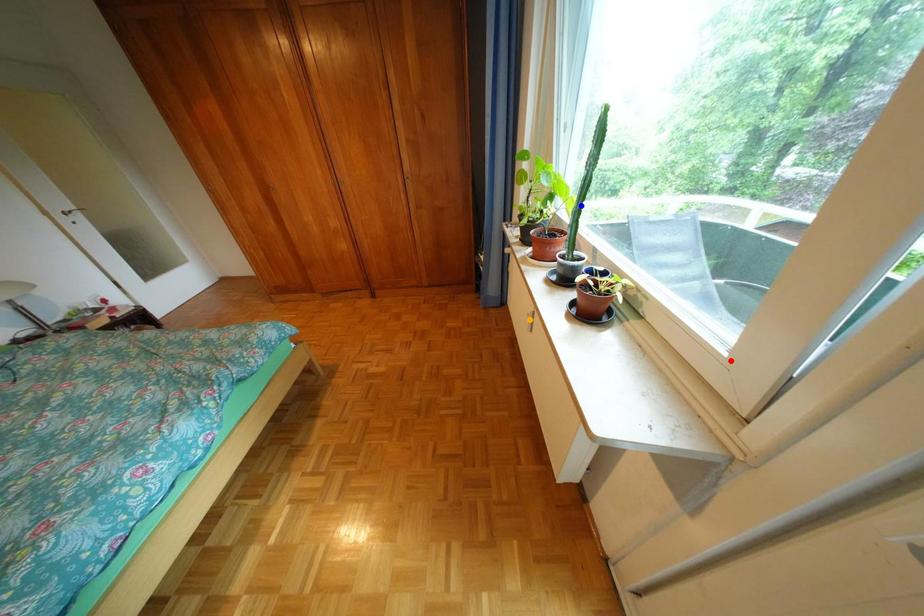
Order these from farthest to nearest:
1. orange point
2. red point
3. blue point

orange point < blue point < red point